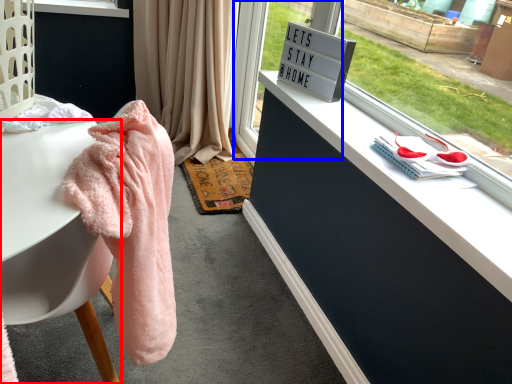
Question: Which object appears farthest to the camera in this image, desk (highlighted by a red box) or glass door (highlighted by a blue box)?

Choices:
 (A) desk
 (B) glass door

Answer: (B)